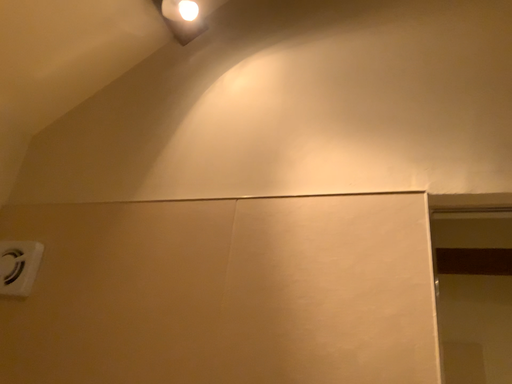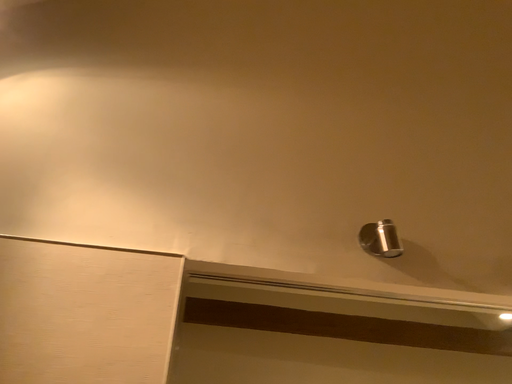
Question: How did the camera likely rotate when shooting the video?

Choices:
 (A) rotated right
 (B) rotated left

Answer: (A)